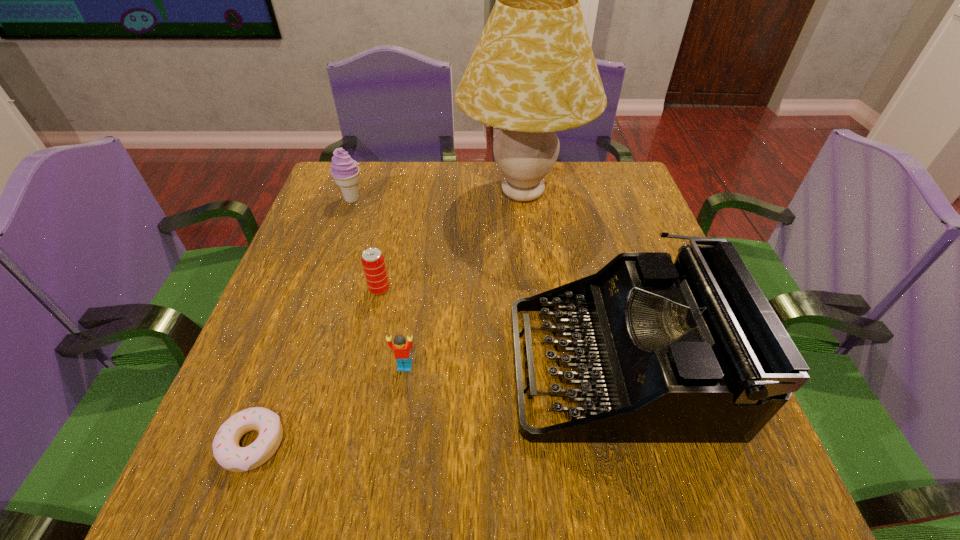
Where is `doughnut that is at the left edge`? This screenshot has width=960, height=540. doughnut that is at the left edge is located at coordinates (226, 450).

The width and height of the screenshot is (960, 540). I want to click on lampshade that is at the right edge, so click(533, 72).

Find the location of a particular element. This screenshot has height=540, width=960. typewriter located in the right edge section of the desktop is located at coordinates (687, 352).

Locate an element on the screen. This screenshot has height=540, width=960. object located at the far left corner is located at coordinates (344, 170).

Locate an element on the screen. The image size is (960, 540). object at the near left corner is located at coordinates (226, 450).

Identify the location of object that is positioned at the far right corner. (533, 72).

Locate an element on the screen. blank space at the far edge is located at coordinates (509, 201).

This screenshot has height=540, width=960. In the image, there is a desktop. Find the location of `free space at the left edge`. free space at the left edge is located at coordinates (329, 235).

The width and height of the screenshot is (960, 540). Find the location of `free location at the right edge of the desktop`. free location at the right edge of the desktop is located at coordinates (599, 240).

The image size is (960, 540). Find the location of `vacant space at the far left corner of the desktop`. vacant space at the far left corner of the desktop is located at coordinates (321, 202).